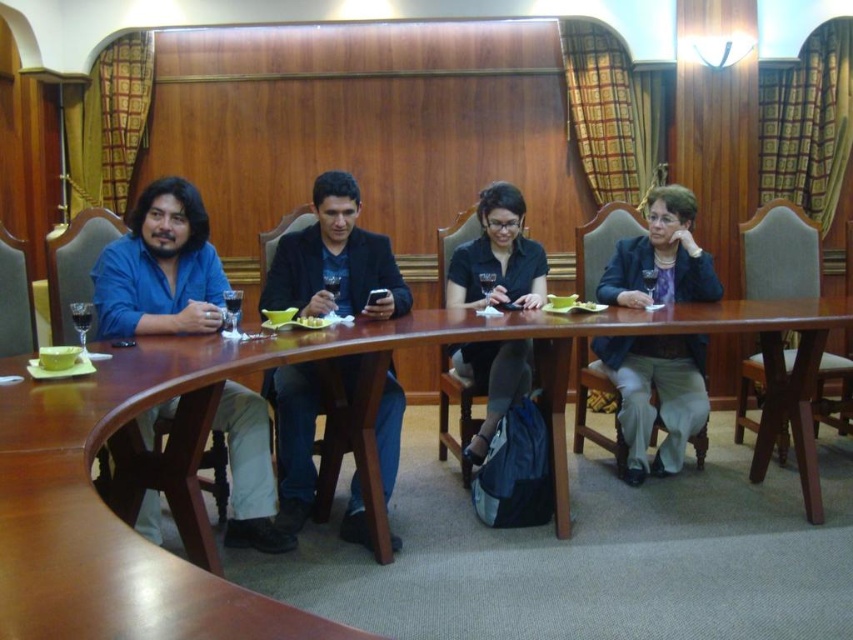
You are organizing a meeting and need to place a 2.5 meter long banner on the brown wood table at center. Considering the table is longer than the matte blue blazer at right, will the banner fit on the table?

The brown wood table at center is larger in width than the matte blue blazer at right, but the banner length is 2.5 meters. Since the table width is only compared to the blazer and not given an exact measurement, it is uncertain if the banner will fit. More information about the table dimensions is needed.

You are organizing a meeting and need to place a name tag for the person in the matte black shirt at center on the brown wood table at center. Can you fit the name tag on the table without overlapping the shirt?

Result: The brown wood table at center is wider than matte black shirt at center, so yes, there is enough space to place the name tag without overlapping the shirt.

You are standing in front of a brown wood table at center in a room with beige carpet. You want to place a 28 inch wide laptop on the table. Can the laptop fit on the table?

The distance between the brown wood table at center and the viewer is 31.71 inches, but this measurement refers to the distance from the viewer to the table, not the table width. The table width is unknown, so we cannot determine if the laptop will fit.